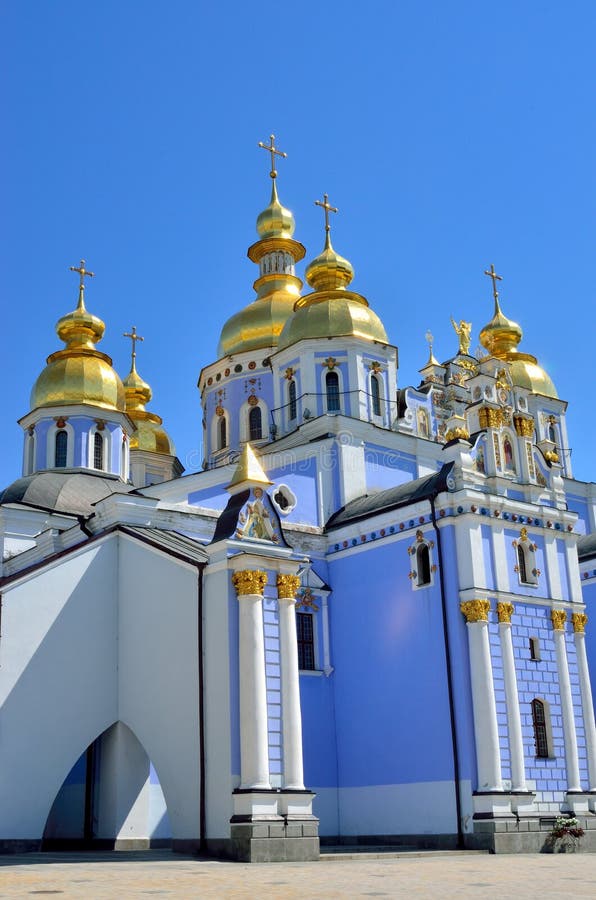
Identify the location of walls. (567, 819), (558, 831), (577, 830).